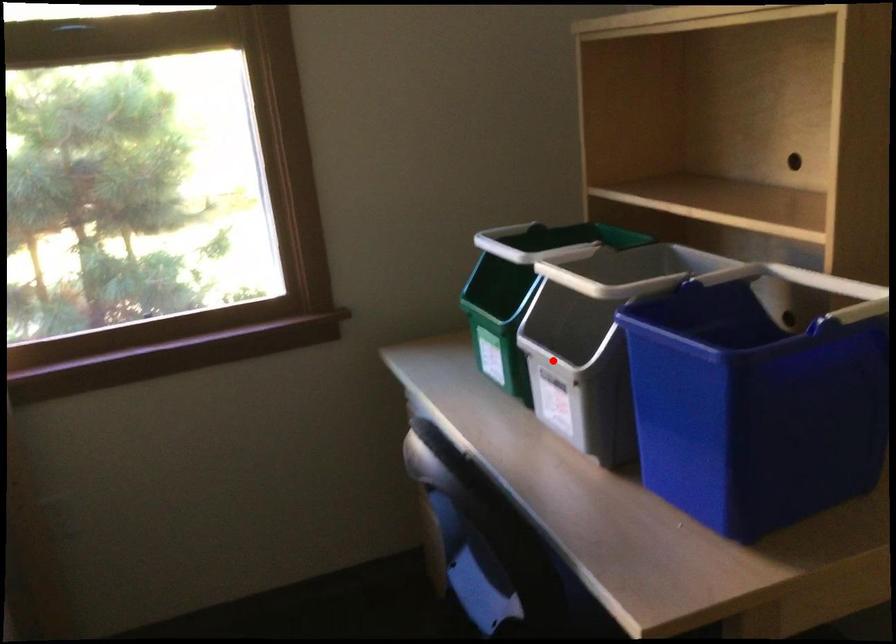
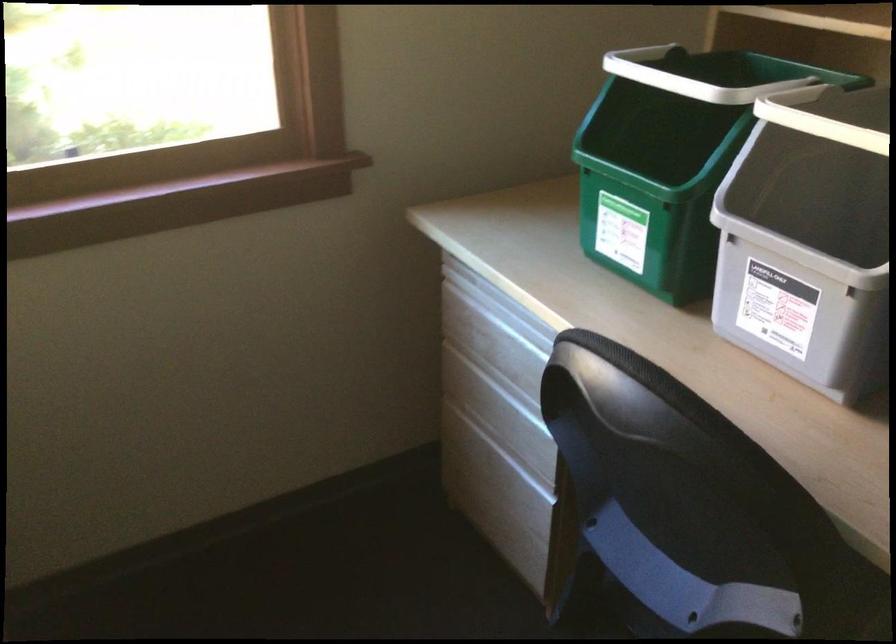
Question: I am providing you with two images of the same scene from different viewpoints. A red point is shown in image1. For the corresponding object point in image2, is it positioned nearer or farther from the camera?

Choices:
 (A) Nearer
 (B) Farther

Answer: (A)